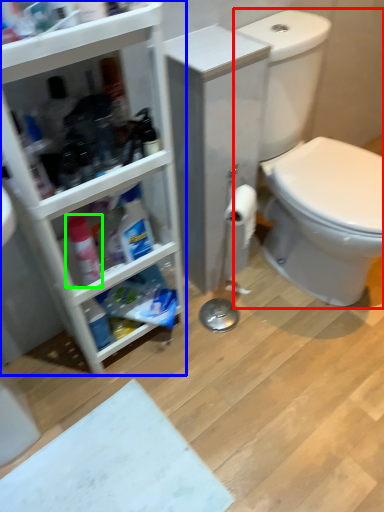
Question: Estimate the real-world distances between objects in this image. Which object is farther from sit (highlighted by a red box), bathroom cabinet (highlighted by a blue box) or cleaning product (highlighted by a green box)?

Choices:
 (A) bathroom cabinet
 (B) cleaning product

Answer: (B)